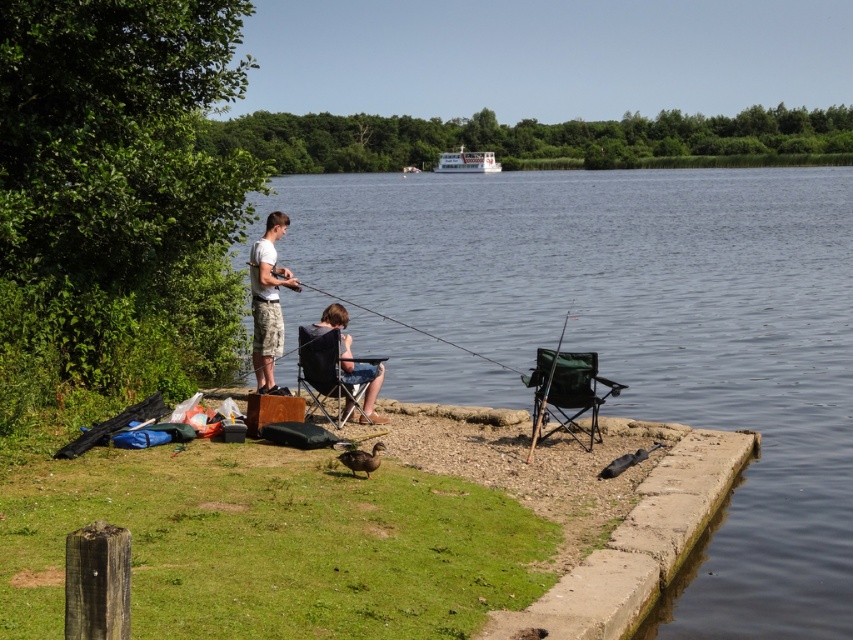
Question: In this image, where is white matte shirt at center located relative to green fabric fishing pole at center?

Choices:
 (A) right
 (B) left

Answer: (B)

Question: Can you confirm if clear blue water at center is thinner than green fabric fishing pole at right?

Choices:
 (A) no
 (B) yes

Answer: (A)

Question: Which point appears farthest from the camera in this image?

Choices:
 (A) (263, 360)
 (B) (447, 168)

Answer: (B)

Question: Can you confirm if white glossy boat at upper center is positioned to the right of green fabric fishing pole at center?

Choices:
 (A) yes
 (B) no

Answer: (A)

Question: Which of the following is the farthest from the observer?

Choices:
 (A) clear blue water at center
 (B) green fabric fishing pole at right
 (C) green fabric fishing pole at center
 (D) white plastic boat at upper center

Answer: (D)

Question: Which of the following is the closest to the observer?

Choices:
 (A) (822, 424)
 (B) (445, 340)

Answer: (A)